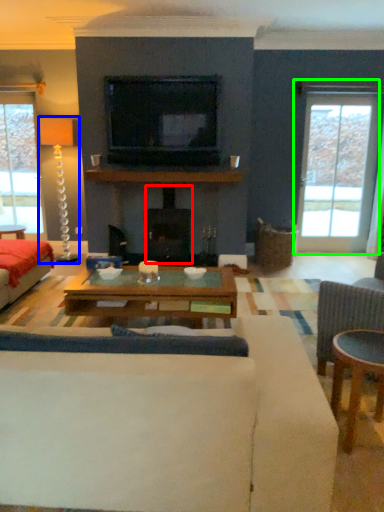
Question: Which object is the farthest from fireplace (highlighted by a red box)? Choose among these: lamp (highlighted by a blue box) or window (highlighted by a green box).

Choices:
 (A) lamp
 (B) window

Answer: (B)